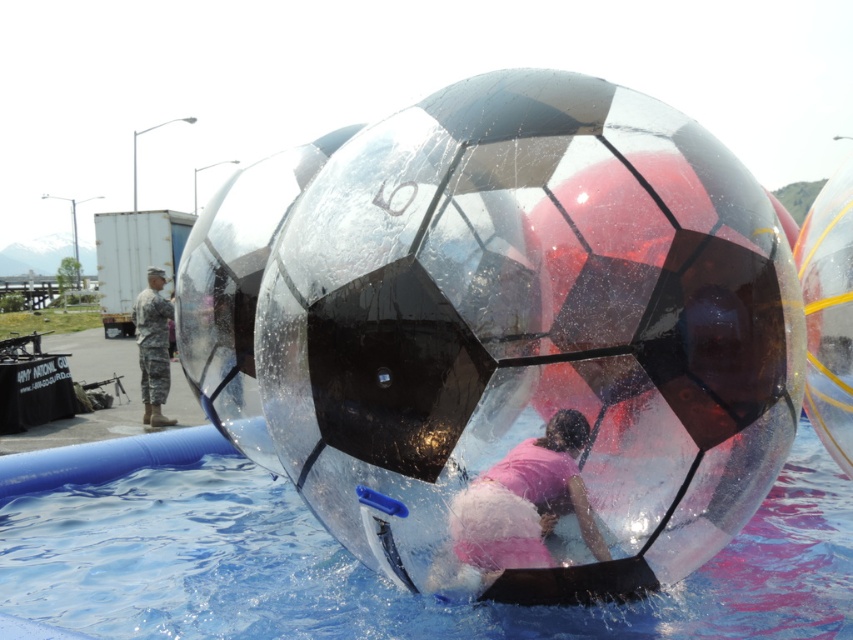
You are a photographer at the event and want to capture both the transparent plastic beach ball at center and the camouflage uniform at left in your photo. Which object will appear larger in the photo?

The transparent plastic beach ball at center will appear larger in the photo because it is closer to the viewer than the camouflage uniform at left.